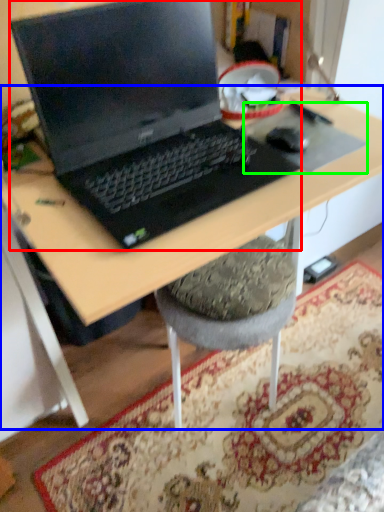
Question: Which is nearer to the laptop (highlighted by a red box)? desk (highlighted by a blue box) or mousepad (highlighted by a green box).

Choices:
 (A) desk
 (B) mousepad

Answer: (A)